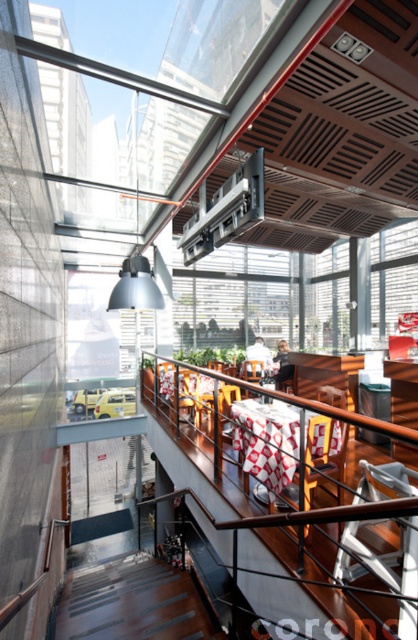
Which is behind, point (382, 424) or point (97, 531)?

The point (97, 531) is more distant.

Which is below, wooden at upper center or smooth concrete floor at lower center?

smooth concrete floor at lower center

Where is `wooden at upper center`? The height and width of the screenshot is (640, 418). wooden at upper center is located at coordinates (305, 499).

Between wooden at upper center and dark wood stairs at lower center, which one is positioned higher?

wooden at upper center is higher up.

Is point (405, 547) farther from camera compared to point (55, 621)?

No, (405, 547) is closer to viewer.

Locate an element on the screen. This screenshot has width=418, height=640. wooden at upper center is located at coordinates click(x=305, y=499).

Who is more forward, (135,628) or (97,518)?

Positioned in front is point (135,628).

The image size is (418, 640). In order to click on dark wood stairs at lower center in this screenshot , I will do `click(132, 602)`.